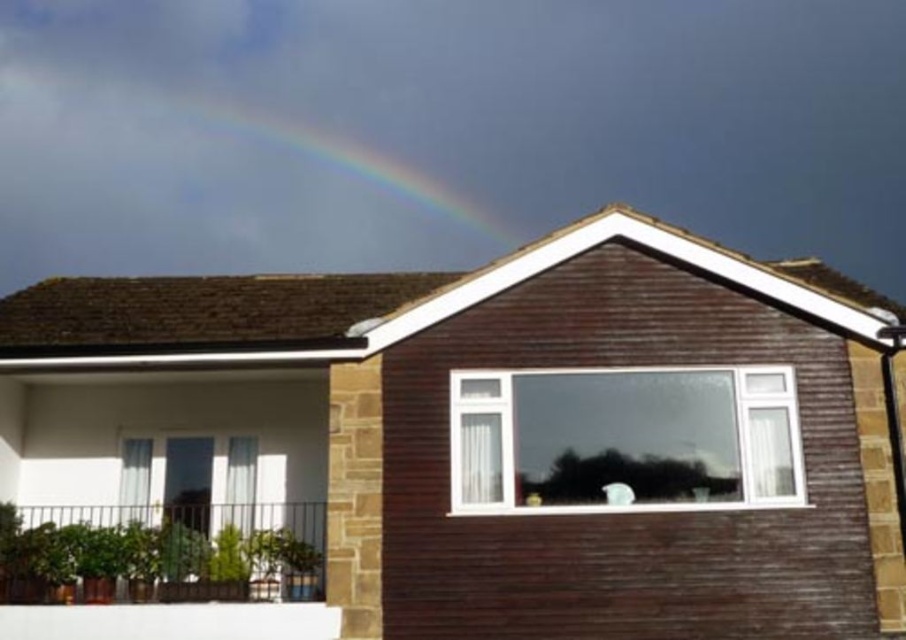
You are standing in front of the residential building and notice the clear glass window at center and the rainbow at upper center. Which object is taller when viewed from your perspective?

The rainbow at upper center is taller than the clear glass window at center.